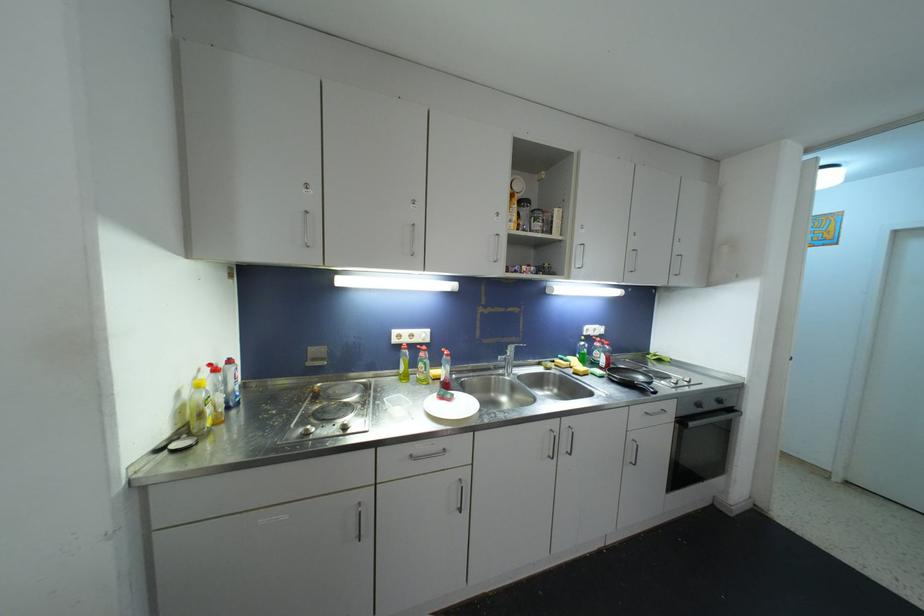
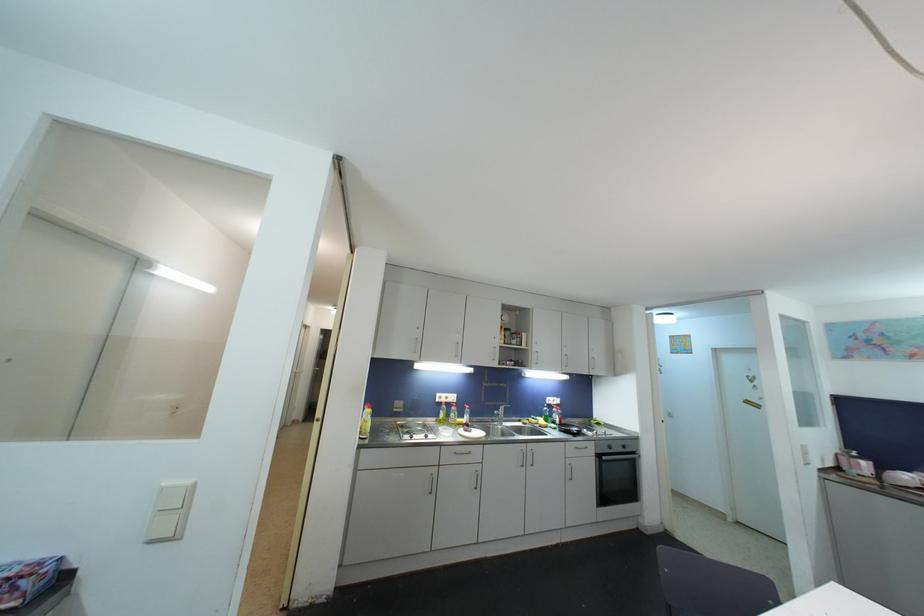
In the second image, find the point that corresponds to pixel 566 448 in the first image.

(532, 464)